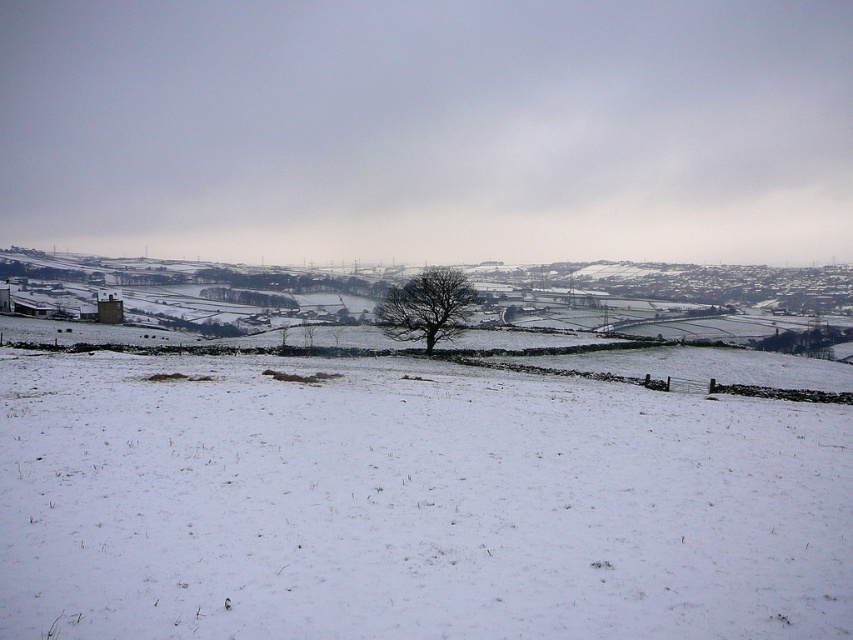
You are a hiker trying to navigate through the white powdery snow at center and the bare brown tree at center. Which object is taller, and could you use the tree as a landmark to avoid getting lost?

The bare brown tree at center is taller than the white powdery snow at center. You can use the tree as a landmark to avoid getting lost since it stands out more in the snowy landscape.

You are a hiker trying to navigate through the white powdery snow at center and the bare brown tree at center. Which object is closer to the ground?

The white powdery snow at center is below the bare brown tree at center, so it is closer to the ground.

You are an artist planning to paint this winter scene. You want to ensure the white powdery snow at center and the bare brown tree at center are proportionally accurate. Which object should you draw larger to maintain the correct scale?

The white powdery snow at center should be drawn larger than the bare brown tree at center to maintain the correct scale.